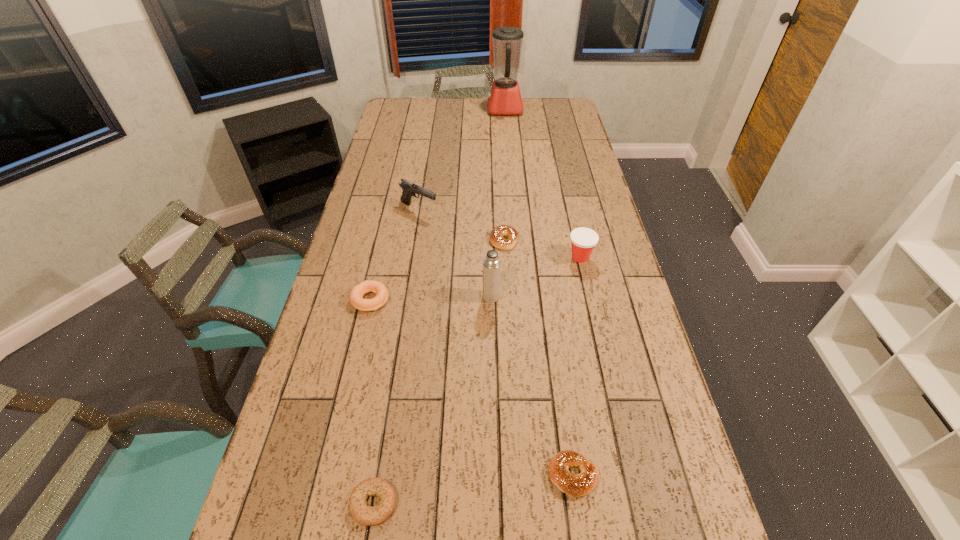
The image size is (960, 540). Identify the location of blender. (504, 98).

Image resolution: width=960 pixels, height=540 pixels. In order to click on the farthest object in this screenshot , I will do `click(504, 98)`.

This screenshot has height=540, width=960. I want to click on thermos bottle, so click(x=491, y=265).

Locate an element on the screen. Image resolution: width=960 pixels, height=540 pixels. the seventh nearest object is located at coordinates (409, 189).

The image size is (960, 540). What are the coordinates of `gun` in the screenshot? It's located at (409, 189).

You are a GUI agent. You are given a task and a screenshot of the screen. Output one action in this format:
    pyautogui.click(x=<x>, y=<y>)
    Task: Click on the Dixie cup
    
    Given the screenshot: What is the action you would take?
    pyautogui.click(x=583, y=240)

This screenshot has height=540, width=960. In order to click on the fourth tallest object in this screenshot , I will do `click(583, 240)`.

Image resolution: width=960 pixels, height=540 pixels. I want to click on the tallest bagel, so click(377, 287).

What are the coordinates of `the fifth tallest object` in the screenshot? It's located at (377, 287).

The height and width of the screenshot is (540, 960). In order to click on the third bagel from left to right in this screenshot , I will do `click(497, 234)`.